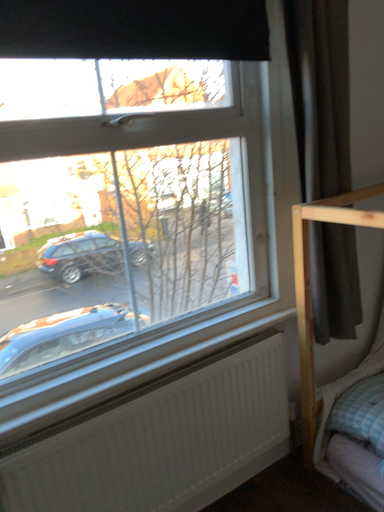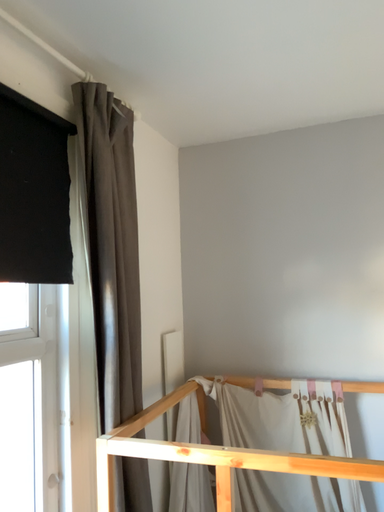
Question: How did the camera likely rotate when shooting the video?

Choices:
 (A) rotated upward
 (B) rotated downward

Answer: (A)